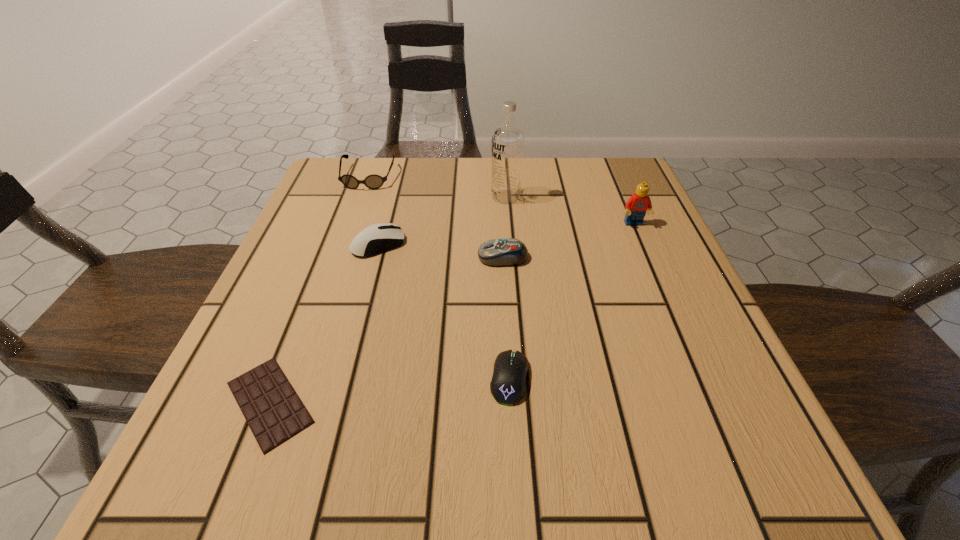
I want to click on vacant space located 0.070m on the front label of the vodka, so click(461, 197).

This screenshot has width=960, height=540. I want to click on free space located 0.130m on the face of the second tallest object, so click(x=653, y=269).

Identify the location of vacant position located 0.180m on the lenses of the sunglasses. (347, 238).

Locate an element on the screen. free spot located 0.050m on the right of the leftmost computer equipment is located at coordinates (429, 244).

Image resolution: width=960 pixels, height=540 pixels. What are the coordinates of `free space located on the back of the shortest computer equipment` in the screenshot? It's located at (503, 268).

At what (x,y) coordinates should I click in order to perform the action: click on vacant space located on the right of the shortest object. Please return your answer as a coordinate pair (x, y). This screenshot has height=540, width=960. Looking at the image, I should click on point(439,402).

Locate an element on the screen. The image size is (960, 540). vodka at the far edge is located at coordinates (507, 150).

This screenshot has height=540, width=960. I want to click on sunglasses that is positioned at the far edge, so click(x=373, y=181).

Where is `object positioned at the near edge`? object positioned at the near edge is located at coordinates (273, 410).

Image resolution: width=960 pixels, height=540 pixels. In order to click on sunglasses located in the left edge section of the desktop in this screenshot , I will do `click(373, 181)`.